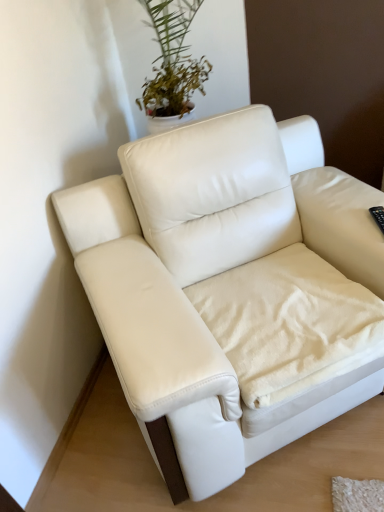
Question: Would you say white leather couch at center is to the left or to the right of white soft blanket at center in the picture?

Choices:
 (A) right
 (B) left

Answer: (B)

Question: Is white leather couch at center in front of or behind white soft blanket at center in the image?

Choices:
 (A) front
 (B) behind

Answer: (A)

Question: From a real-world perspective, is white leather couch at center positioned above or below white soft blanket at center?

Choices:
 (A) above
 (B) below

Answer: (A)

Question: Looking at their shapes, would you say white soft blanket at center is wider or thinner than white leather couch at center?

Choices:
 (A) wide
 (B) thin

Answer: (B)

Question: From the image's perspective, is white soft blanket at center located above or below white leather couch at center?

Choices:
 (A) above
 (B) below

Answer: (B)

Question: Is white soft blanket at center situated inside white leather couch at center or outside?

Choices:
 (A) outside
 (B) inside

Answer: (B)

Question: In the image, is white soft blanket at center positioned in front of or behind white leather couch at center?

Choices:
 (A) front
 (B) behind

Answer: (B)